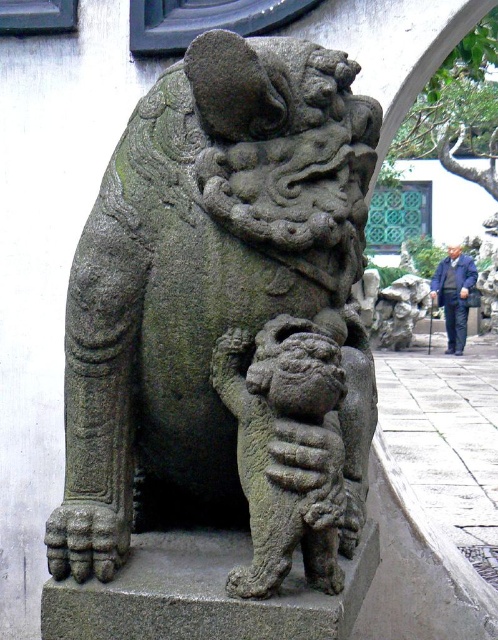
You are an architect designing a new garden and want to place a statue of a mythical creature. The statue has a point at coordinates point [299,493]. If the statue is 39.16 inches tall, will it fit in a space that is 40 inches tall?

The statue with a point at coordinates point [299,493] is 39.16 inches tall. Since the available space is 40 inches tall, the statue will fit comfortably within the space.

You are a tour guide standing at a distance from the gray stone lion at center. Your tour group asks if they can safely approach the sculpture to take photos without damaging it. The museum requires a minimum safe distance of 1 meter to protect the artifact. Based on your current position, can your group approach closer?

The gray stone lion at center is currently 96.95 centimeters away from the viewer. Since the required minimum safe distance is 1 meter, the group cannot approach any closer as they are already within the restricted zone.